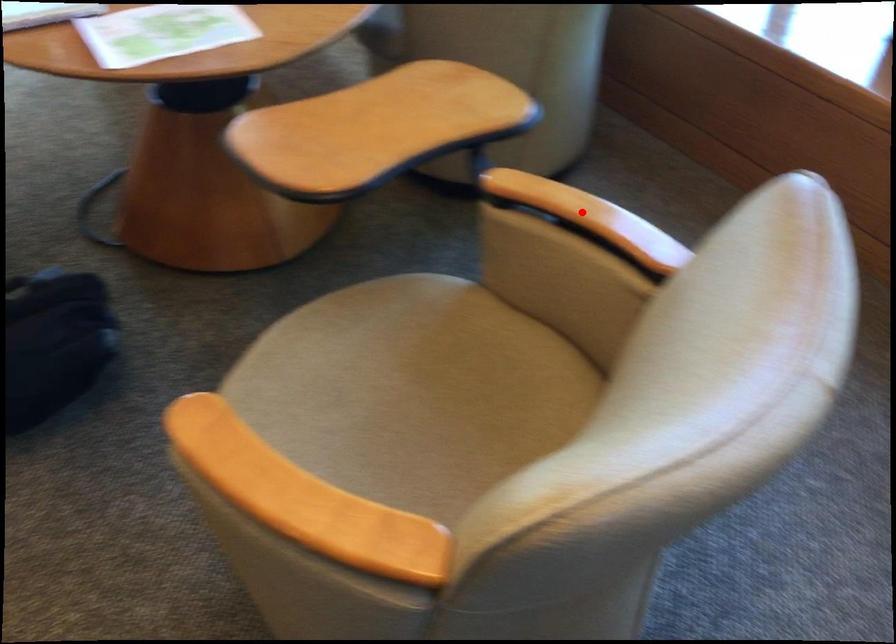
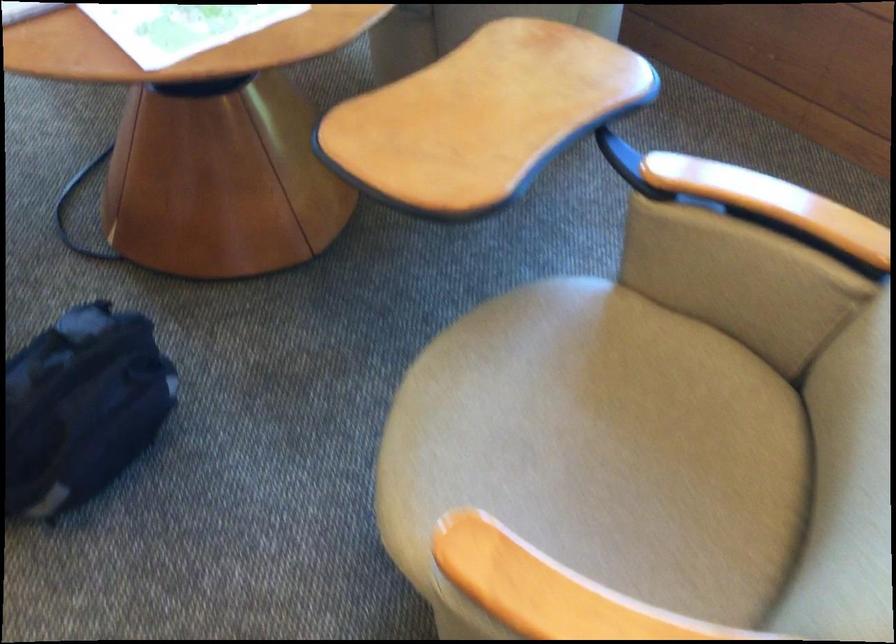
The point at the highlighted location is marked in the first image. Where is the corresponding point in the second image?

(771, 202)